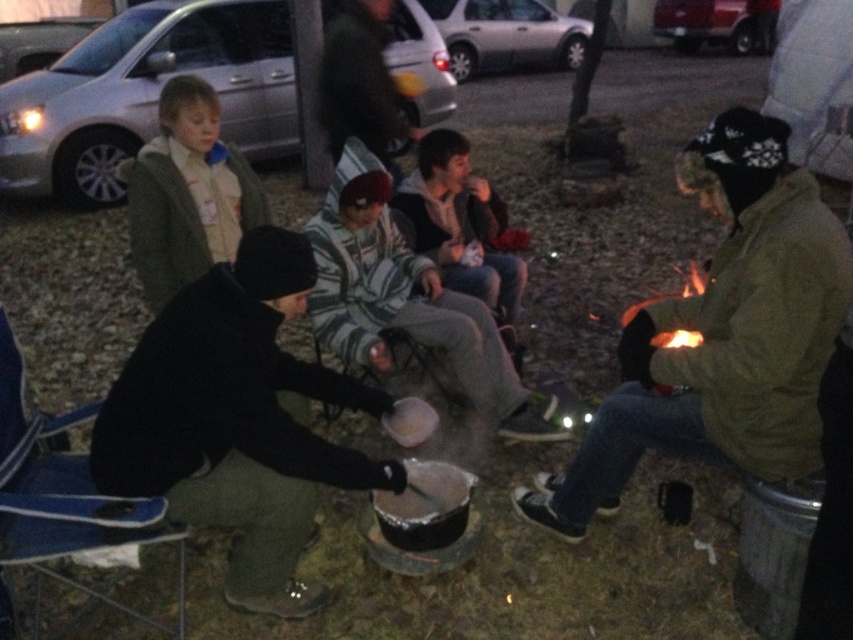
Looking at this image, you are standing at the edge of the fire pit and want to hand the striped fabric jacket at center to someone behind you. Can you reach it without moving the black matte pot at center?

The black matte pot at center is closer to the viewer than striped fabric jacket at center, so the jacket is further away. To hand the jacket to someone behind you, you would need to move the pot to access the jacket.

You are standing at point [346,157] and want to walk to the fire pit. Is the point [811,353] blocking your path?

Point [811,353] is in front of point [346,157], so it is blocking your path to the fire pit.